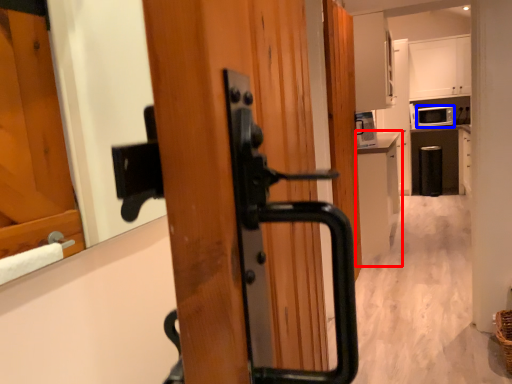
Question: Which object is closer to the camera taking this photo, cabinetry (highlighted by a red box) or appliance (highlighted by a blue box)?

Choices:
 (A) cabinetry
 (B) appliance

Answer: (A)